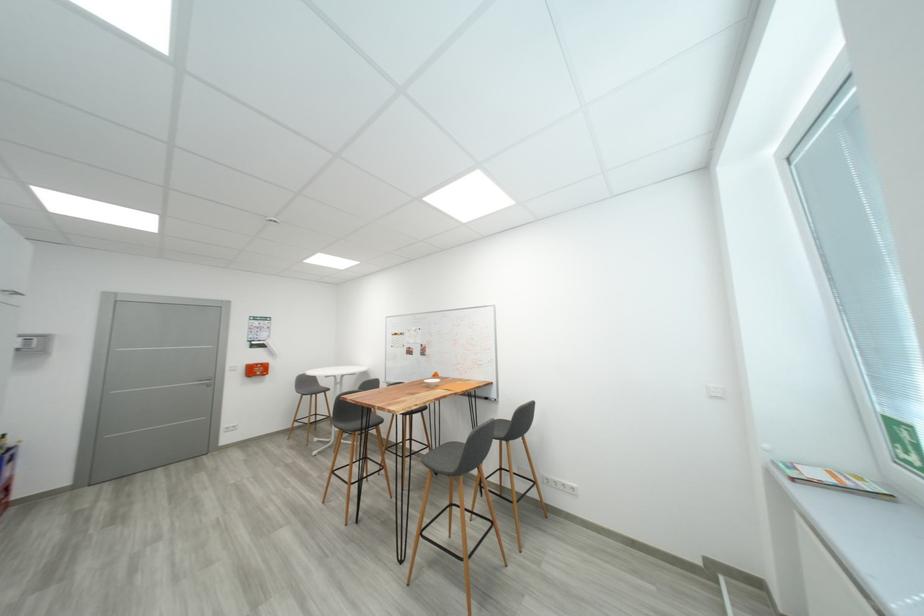
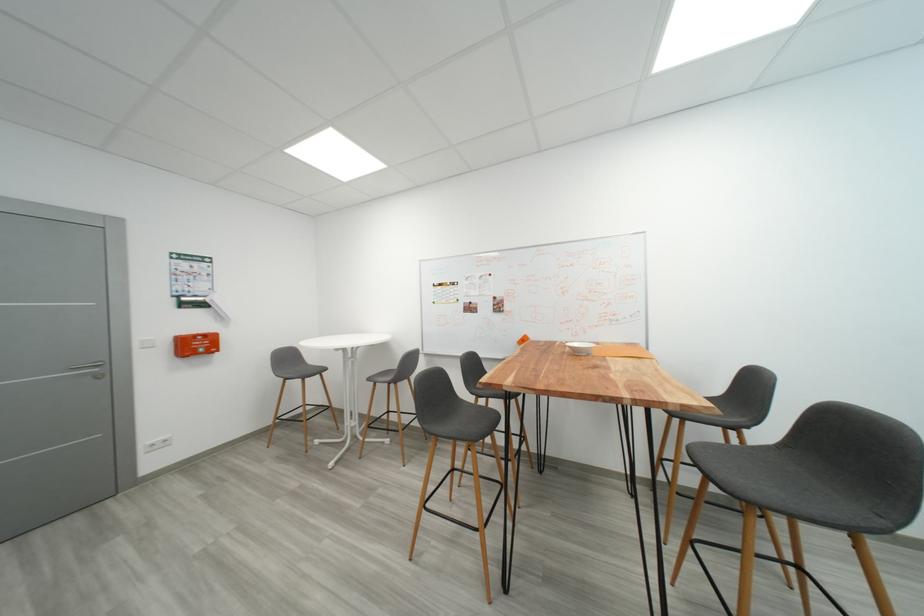
Locate, in the second image, the point that corresponds to (x=349, y=428) in the first image.

(446, 431)